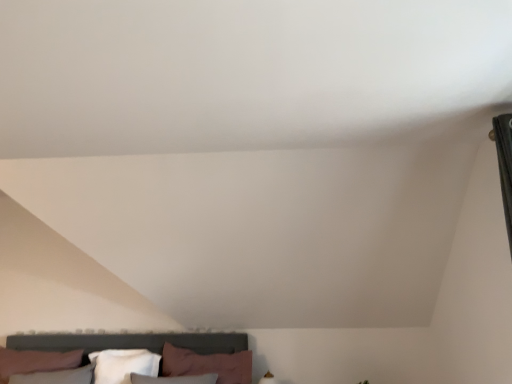
Question: Is white soft pillow at lower center, the second pillow in the right-to-left sequence, spatially inside pink fabric pillow at lower center, which appears as the first pillow when viewed from the right, or outside of it?

Choices:
 (A) outside
 (B) inside

Answer: (A)

Question: In the image, is white soft pillow at lower center, the second pillow in the right-to-left sequence, positioned in front of or behind pink fabric pillow at lower center, which appears as the first pillow when viewed from the right?

Choices:
 (A) behind
 (B) front

Answer: (A)

Question: Does point (135, 367) appear closer or farther from the camera than point (224, 380)?

Choices:
 (A) farther
 (B) closer

Answer: (B)

Question: Does point (175, 369) appear closer or farther from the camera than point (134, 354)?

Choices:
 (A) closer
 (B) farther

Answer: (A)

Question: From a real-world perspective, is pink fabric pillow at lower center, which appears as the first pillow when viewed from the right, physically located above or below white soft pillow at lower center, the first pillow viewed from the left?

Choices:
 (A) above
 (B) below

Answer: (A)

Question: Is pink fabric pillow at lower center, positioned as the second pillow in left-to-right order, spatially inside white soft pillow at lower center, the second pillow in the right-to-left sequence, or outside of it?

Choices:
 (A) inside
 (B) outside

Answer: (B)

Question: Looking at the image, does pink fabric pillow at lower center, which appears as the first pillow when viewed from the right, seem bigger or smaller compared to white soft pillow at lower center, the second pillow in the right-to-left sequence?

Choices:
 (A) big
 (B) small

Answer: (A)